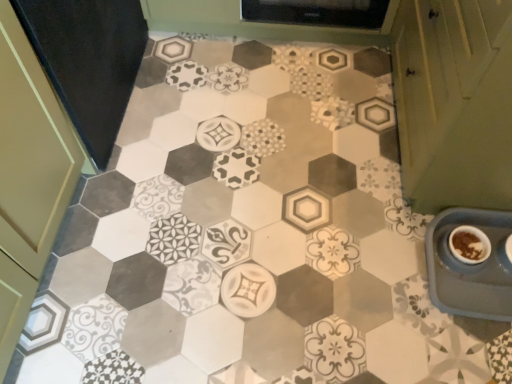
Question: Considering the relative sizes of green matte cabinet at right and blue plastic tray at lower right in the image provided, is green matte cabinet at right shorter than blue plastic tray at lower right?

Choices:
 (A) yes
 (B) no

Answer: (B)

Question: Is green matte cabinet at right not near blue plastic tray at lower right?

Choices:
 (A) no
 (B) yes

Answer: (A)

Question: Can you confirm if green matte cabinet at right is taller than blue plastic tray at lower right?

Choices:
 (A) no
 (B) yes

Answer: (B)

Question: Is blue plastic tray at lower right surrounded by green matte cabinet at right?

Choices:
 (A) yes
 (B) no

Answer: (B)

Question: From a real-world perspective, is green matte cabinet at right positioned over blue plastic tray at lower right based on gravity?

Choices:
 (A) no
 (B) yes

Answer: (B)

Question: Based on their sizes in the image, would you say green matte cabinet at right is bigger or smaller than brown matte bowl at lower right?

Choices:
 (A) big
 (B) small

Answer: (A)

Question: Is green matte cabinet at right wider or thinner than brown matte bowl at lower right?

Choices:
 (A) wide
 (B) thin

Answer: (A)

Question: Would you say green matte cabinet at right is to the left or to the right of brown matte bowl at lower right in the picture?

Choices:
 (A) left
 (B) right

Answer: (B)

Question: Does point (415, 119) appear closer or farther from the camera than point (452, 246)?

Choices:
 (A) farther
 (B) closer

Answer: (B)

Question: Is blue plastic tray at lower right inside the boundaries of brown matte bowl at lower right, or outside?

Choices:
 (A) inside
 (B) outside

Answer: (B)

Question: Considering the positions of point (437, 256) and point (458, 253), is point (437, 256) closer or farther from the camera than point (458, 253)?

Choices:
 (A) farther
 (B) closer

Answer: (A)

Question: Considering the positions of blue plastic tray at lower right and brown matte bowl at lower right in the image, is blue plastic tray at lower right bigger or smaller than brown matte bowl at lower right?

Choices:
 (A) big
 (B) small

Answer: (A)

Question: From the image's perspective, relative to brown matte bowl at lower right, is blue plastic tray at lower right above or below?

Choices:
 (A) above
 (B) below

Answer: (B)

Question: Considering the positions of green matte cabinet at right and blue plastic tray at lower right in the image, is green matte cabinet at right bigger or smaller than blue plastic tray at lower right?

Choices:
 (A) big
 (B) small

Answer: (A)

Question: Is green matte cabinet at right inside or outside of blue plastic tray at lower right?

Choices:
 (A) outside
 (B) inside

Answer: (A)